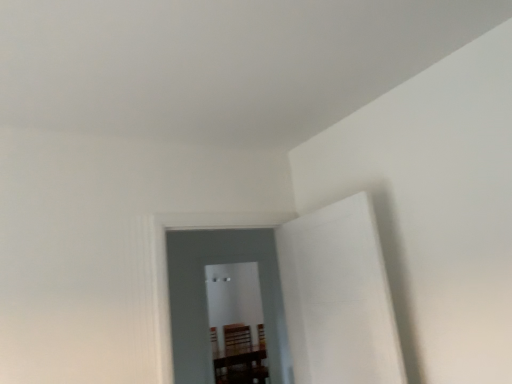
Question: Is transparent glass door at center, marked as the 2th glass door in a front-to-back arrangement, taller than transparent glass door at center, the first glass door positioned from the front?

Choices:
 (A) no
 (B) yes

Answer: (B)

Question: Is transparent glass door at center, which is counted as the first glass door, starting from the back, in front of transparent glass door at center, the first glass door positioned from the front?

Choices:
 (A) no
 (B) yes

Answer: (A)

Question: Considering the relative sizes of transparent glass door at center, marked as the 2th glass door in a front-to-back arrangement, and transparent glass door at center, placed as the second glass door when sorted from back to front, in the image provided, is transparent glass door at center, marked as the 2th glass door in a front-to-back arrangement, bigger than transparent glass door at center, placed as the second glass door when sorted from back to front,?

Choices:
 (A) no
 (B) yes

Answer: (B)

Question: Considering the relative positions of transparent glass door at center, which is counted as the first glass door, starting from the back, and transparent glass door at center, placed as the second glass door when sorted from back to front, in the image provided, is transparent glass door at center, which is counted as the first glass door, starting from the back, to the left of transparent glass door at center, placed as the second glass door when sorted from back to front, from the viewer's perspective?

Choices:
 (A) yes
 (B) no

Answer: (A)

Question: Is transparent glass door at center, which is counted as the first glass door, starting from the back, far away from transparent glass door at center, placed as the second glass door when sorted from back to front?

Choices:
 (A) no
 (B) yes

Answer: (B)

Question: Is transparent glass door at center, which is counted as the first glass door, starting from the back, to the right of transparent glass door at center, placed as the second glass door when sorted from back to front, from the viewer's perspective?

Choices:
 (A) yes
 (B) no

Answer: (B)

Question: From the image's perspective, is transparent glass door at center, placed as the second glass door when sorted from back to front, on transparent glass door at center, which is counted as the first glass door, starting from the back?

Choices:
 (A) no
 (B) yes

Answer: (B)

Question: Does transparent glass door at center, placed as the second glass door when sorted from back to front, appear on the right side of transparent glass door at center, marked as the 2th glass door in a front-to-back arrangement?

Choices:
 (A) yes
 (B) no

Answer: (A)

Question: Can you confirm if transparent glass door at center, placed as the second glass door when sorted from back to front, is taller than transparent glass door at center, marked as the 2th glass door in a front-to-back arrangement?

Choices:
 (A) no
 (B) yes

Answer: (A)

Question: Does transparent glass door at center, placed as the second glass door when sorted from back to front, have a larger size compared to transparent glass door at center, which is counted as the first glass door, starting from the back?

Choices:
 (A) no
 (B) yes

Answer: (A)

Question: Is transparent glass door at center, placed as the second glass door when sorted from back to front, thinner than transparent glass door at center, which is counted as the first glass door, starting from the back?

Choices:
 (A) no
 (B) yes

Answer: (B)

Question: Is transparent glass door at center, placed as the second glass door when sorted from back to front, facing towards transparent glass door at center, which is counted as the first glass door, starting from the back?

Choices:
 (A) no
 (B) yes

Answer: (A)

Question: In terms of size, does transparent glass door at center, placed as the second glass door when sorted from back to front, appear bigger or smaller than transparent glass door at center, which is counted as the first glass door, starting from the back?

Choices:
 (A) small
 (B) big

Answer: (A)